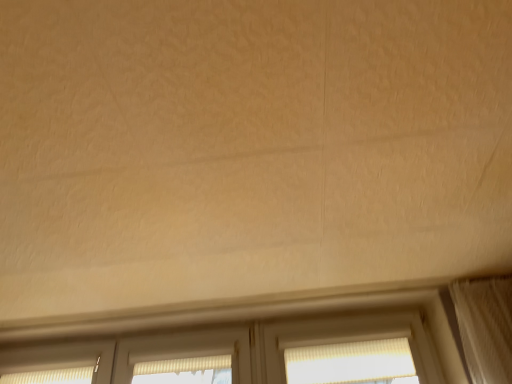
Question: Is point (352, 365) closer or farther from the camera than point (238, 359)?

Choices:
 (A) farther
 (B) closer

Answer: (B)

Question: In terms of width, does white textured window at center look wider or thinner when compared to beige textured screen door at center?

Choices:
 (A) thin
 (B) wide

Answer: (B)

Question: Is white textured window at center in front of or behind beige textured screen door at center in the image?

Choices:
 (A) front
 (B) behind

Answer: (A)

Question: Considering the positions of beige textured screen door at center and white textured window at center in the image, is beige textured screen door at center taller or shorter than white textured window at center?

Choices:
 (A) short
 (B) tall

Answer: (A)

Question: Is point (174, 336) positioned closer to the camera than point (316, 352)?

Choices:
 (A) closer
 (B) farther

Answer: (B)

Question: Would you say beige textured screen door at center is inside or outside white textured window at center?

Choices:
 (A) outside
 (B) inside

Answer: (A)

Question: In the image, is beige textured screen door at center positioned in front of or behind white textured window at center?

Choices:
 (A) behind
 (B) front

Answer: (A)